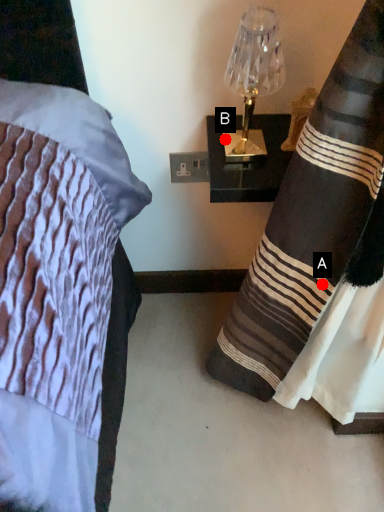
Question: Two points are circled on the image, labeled by A and B beside each circle. Which point appears farthest from the camera in this image?

Choices:
 (A) A is further
 (B) B is further

Answer: (B)